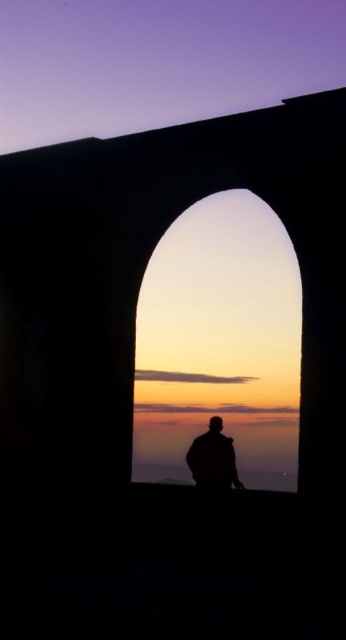
Question: Which point is closer to the camera?

Choices:
 (A) matte stone archway at center
 (B) silhouette figure at center

Answer: (A)

Question: Is matte stone archway at center bigger than silhouette figure at center?

Choices:
 (A) yes
 (B) no

Answer: (A)

Question: Which object is closer to the camera taking this photo?

Choices:
 (A) matte stone archway at center
 (B) silhouette figure at center

Answer: (A)

Question: Observing the image, what is the correct spatial positioning of matte stone archway at center in reference to silhouette figure at center?

Choices:
 (A) right
 (B) left

Answer: (A)

Question: Can you confirm if matte stone archway at center is positioned below silhouette figure at center?

Choices:
 (A) yes
 (B) no

Answer: (B)

Question: Which point appears closest to the camera in this image?

Choices:
 (A) (213, 444)
 (B) (262, 246)

Answer: (A)